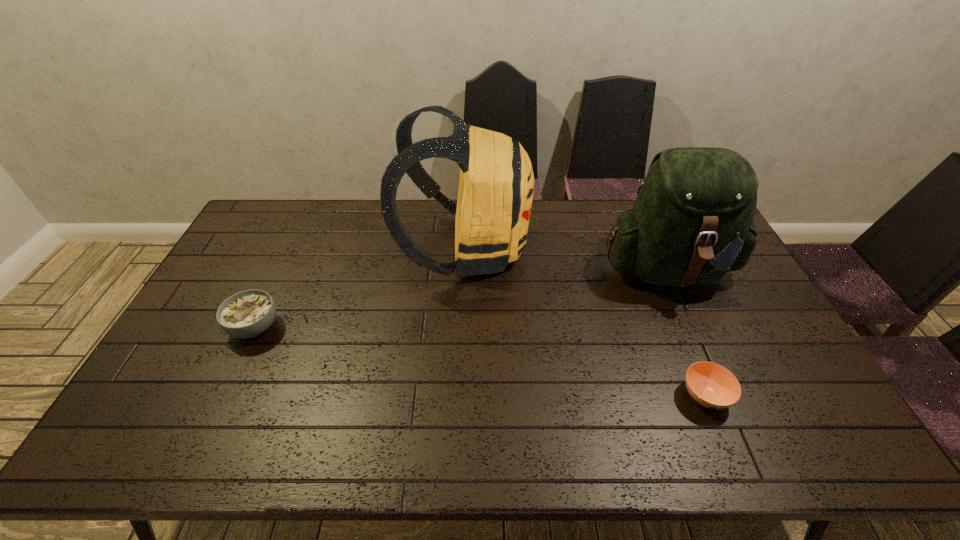
Locate an element on the screen. The width and height of the screenshot is (960, 540). object situated at the left edge is located at coordinates (246, 314).

This screenshot has height=540, width=960. I want to click on object at the right edge, so click(x=692, y=222).

I want to click on object that is at the far right corner, so click(692, 222).

At what (x,y) coordinates should I click in order to perform the action: click on vacant area at the far edge of the desktop. Please return your answer as a coordinate pair (x, y). The image size is (960, 540). Looking at the image, I should click on click(300, 234).

Where is `blank space at the near edge`? This screenshot has width=960, height=540. blank space at the near edge is located at coordinates (709, 436).

This screenshot has width=960, height=540. In the image, there is a desktop. Find the location of `free space at the left edge`. free space at the left edge is located at coordinates (252, 262).

Identify the location of free spot at the near left corner of the desktop. The height and width of the screenshot is (540, 960). (125, 430).

Find the location of `unoccupied position between the shortest object and the left backpack`. unoccupied position between the shortest object and the left backpack is located at coordinates (585, 323).

At what (x,y) coordinates should I click in order to perform the action: click on vacant area that lies between the taller soup bowl and the nearer soup bowl. Please return your answer as a coordinate pair (x, y). Looking at the image, I should click on (480, 362).

You are a GUI agent. You are given a task and a screenshot of the screen. Output one action in this format:
    pyautogui.click(x=<x>, y=<y>)
    Task: Click on the free space that is in between the taller soup bowl and the third object from right to left
    This screenshot has width=960, height=540.
    Given the screenshot: What is the action you would take?
    (x=360, y=288)